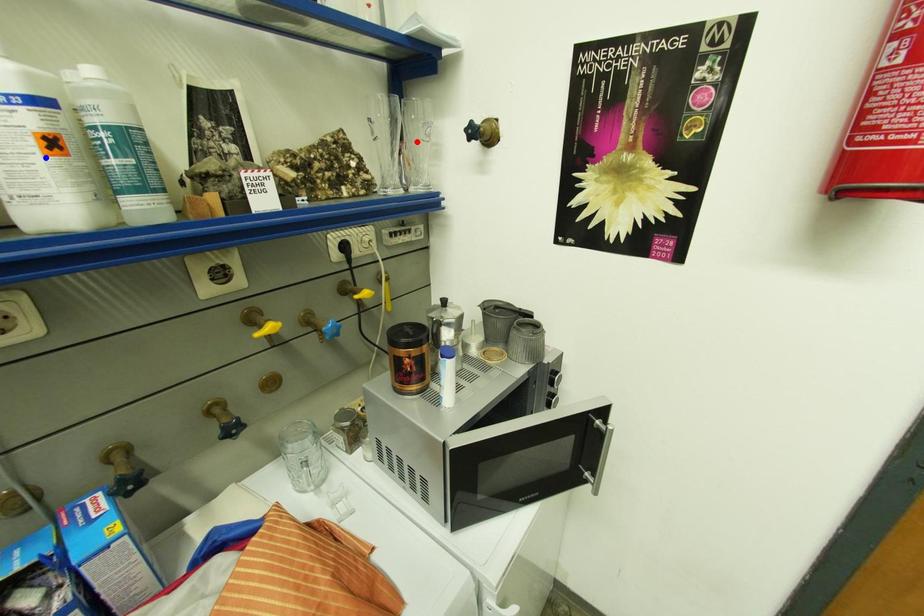
Question: Which of the two points in the image is closer to the camera?

Choices:
 (A) Blue point is closer.
 (B) Red point is closer.

Answer: (A)